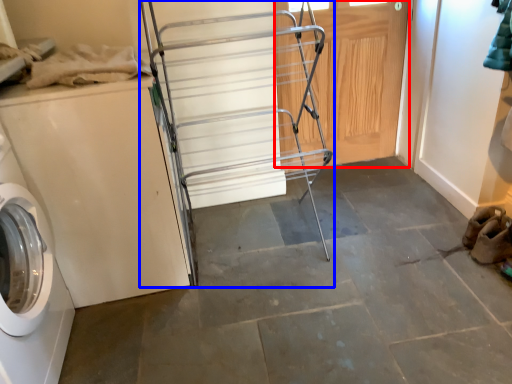
Question: Which of the following is the closest to the observer, door (highlighted by a red box) or cart (highlighted by a blue box)?

Choices:
 (A) door
 (B) cart

Answer: (B)